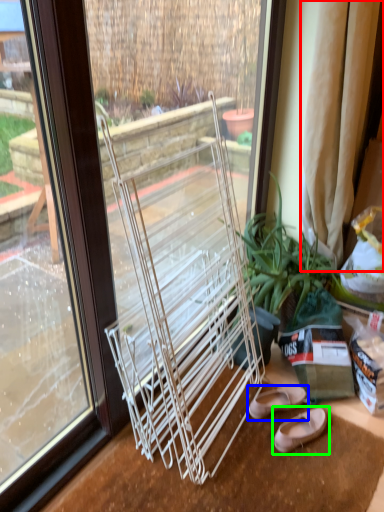
Question: Considering the real-world distances, which object is farthest from curtain (highlighted by a red box)? footwear (highlighted by a blue box) or footwear (highlighted by a green box)?

Choices:
 (A) footwear
 (B) footwear

Answer: (B)